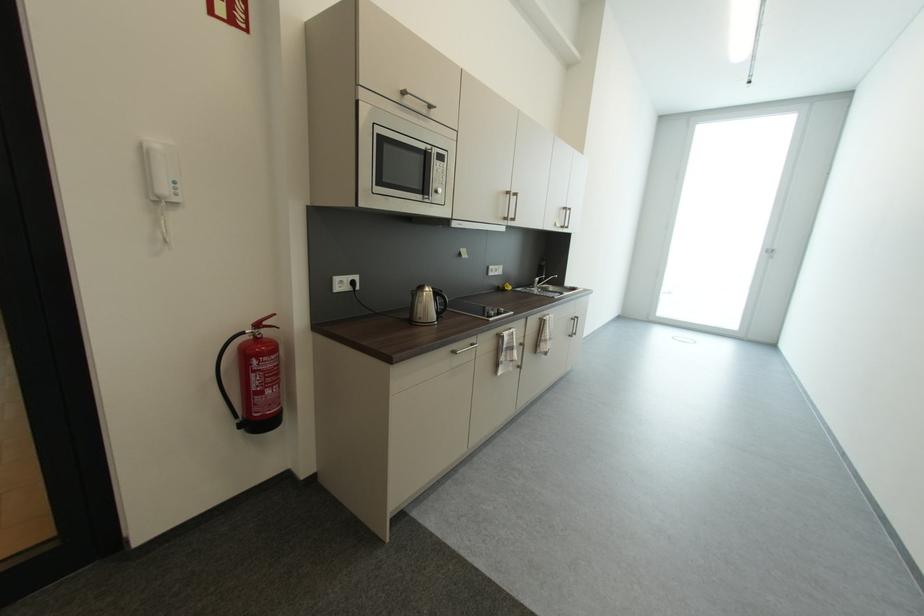
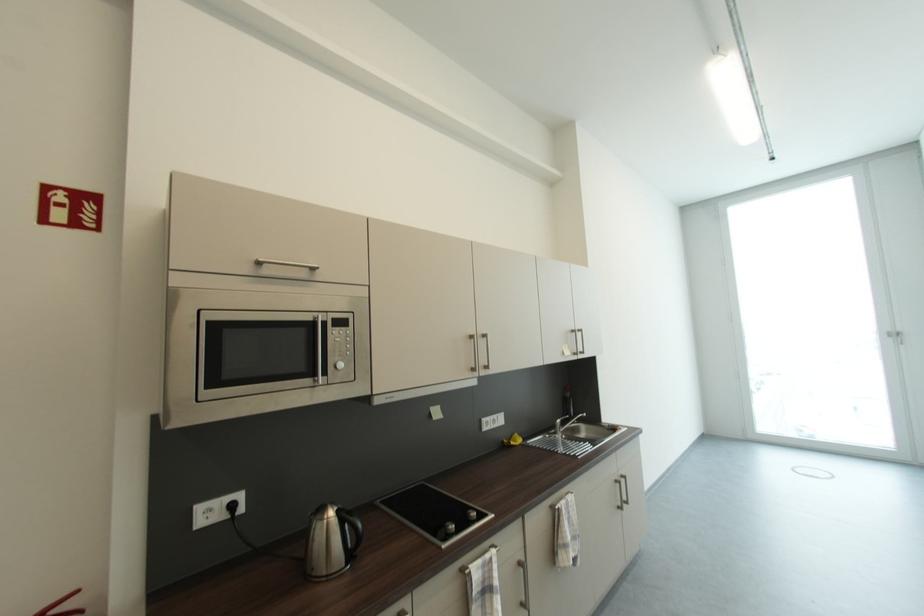
Question: Based on the continuous images, in which direction is the camera rotating? Reply with the corresponding letter.

Choices:
 (A) Left
 (B) Right
 (C) Up
 (D) Down

Answer: (C)